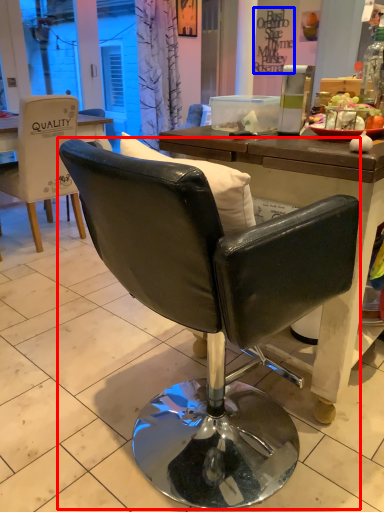
Question: Which object is closer to the camera taking this photo, chair (highlighted by a red box) or writing (highlighted by a blue box)?

Choices:
 (A) chair
 (B) writing

Answer: (A)